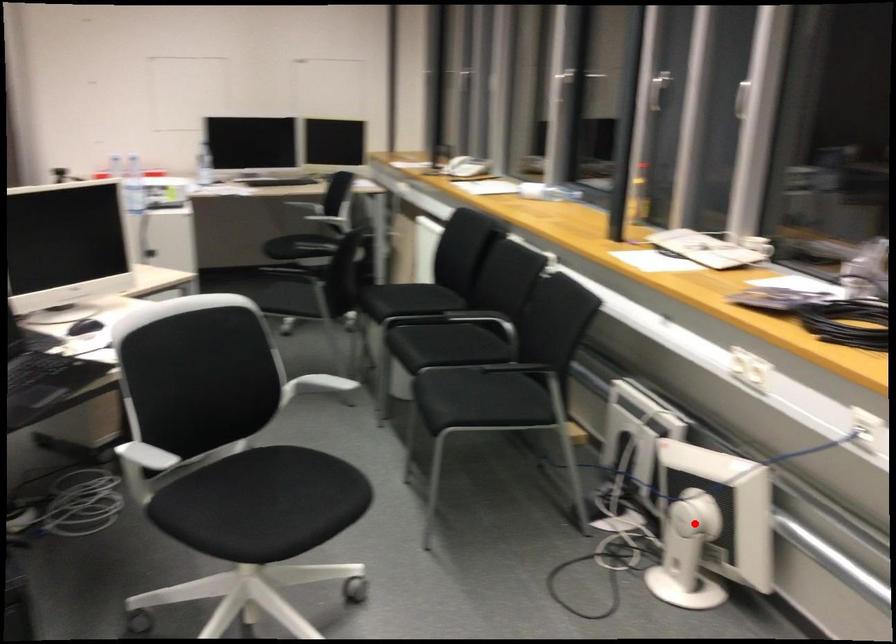
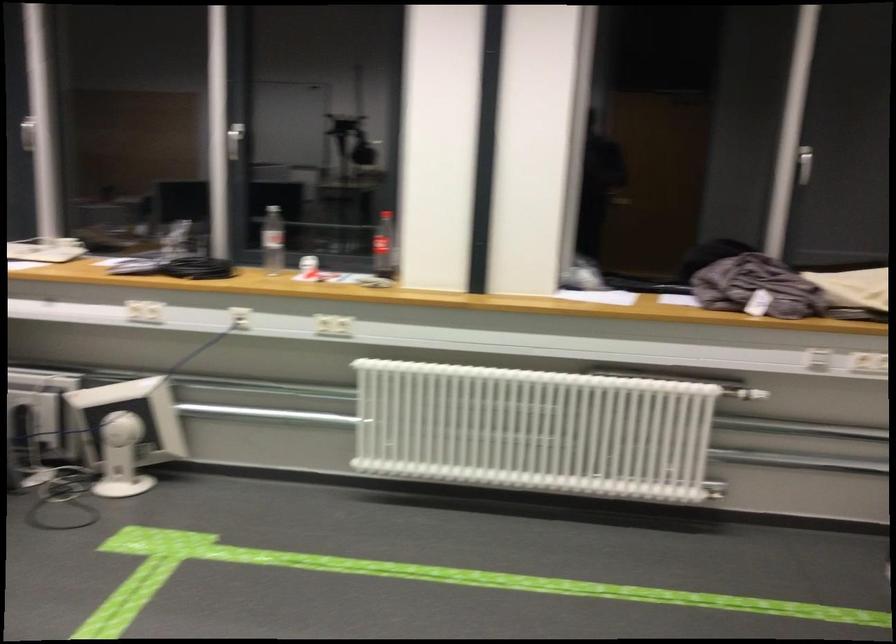
Where in the second image is the point corresponding to the highlighted location from the first image?

(126, 431)